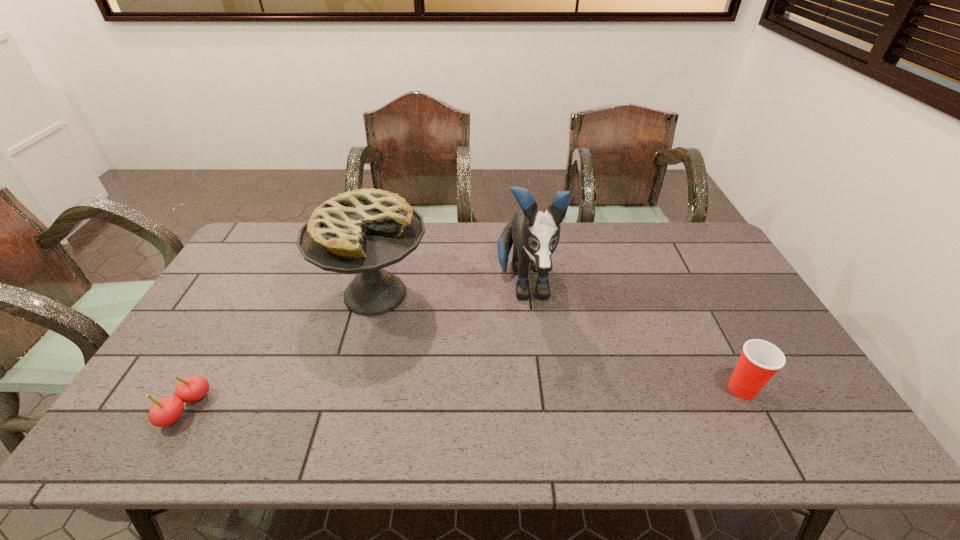
Where is `free space between the third object from left to right and the third object from right to left`? free space between the third object from left to right and the third object from right to left is located at coordinates (449, 290).

Identify the location of blank region between the second tallest object and the tallest object. The height and width of the screenshot is (540, 960). (449, 290).

Locate an element on the screen. The width and height of the screenshot is (960, 540). empty location between the Dixie cup and the second object from left to right is located at coordinates (559, 342).

The width and height of the screenshot is (960, 540). I want to click on vacant space that is in between the second object from left to right and the third tallest object, so pos(559,342).

I want to click on free space between the third object from left to right and the pie, so click(x=449, y=290).

Find the location of a particular element. This screenshot has height=540, width=960. free spot between the Dixie cup and the tallest object is located at coordinates coord(633,338).

I want to click on vacant area that lies between the second shortest object and the tallest object, so (633, 338).

In order to click on object that stands as the closest to the puppy in this screenshot , I will do `click(362, 231)`.

Locate which object is the third closest to the third shortest object. Please provide its 2D coordinates. Your answer should be formatted as a tuple, i.e. [(x, y)], where the tuple contains the x and y coordinates of a point satisfying the conditions above.

[(760, 360)]